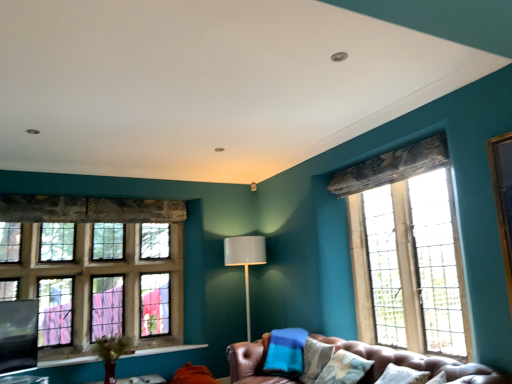
Question: From the image's perspective, is stained glass window at left, which is counted as the second window, starting from the right, located above matte gray lamp at center?

Choices:
 (A) no
 (B) yes

Answer: (B)

Question: Can we say stained glass window at left, the 1th window from the left, lies outside matte gray lamp at center?

Choices:
 (A) yes
 (B) no

Answer: (A)

Question: From a real-world perspective, is stained glass window at left, which is counted as the second window, starting from the right, under matte gray lamp at center?

Choices:
 (A) no
 (B) yes

Answer: (A)

Question: Considering the relative sizes of stained glass window at left, which is counted as the second window, starting from the right, and matte gray lamp at center in the image provided, is stained glass window at left, which is counted as the second window, starting from the right, shorter than matte gray lamp at center?

Choices:
 (A) yes
 (B) no

Answer: (A)

Question: Can you confirm if stained glass window at left, the 1th window from the back, is positioned to the left of matte gray lamp at center?

Choices:
 (A) no
 (B) yes

Answer: (B)

Question: From a real-world perspective, relative to black matte window screen at lower left, is stained glass window at left, the 1th window from the back, vertically above or below?

Choices:
 (A) above
 (B) below

Answer: (A)

Question: Which is correct: stained glass window at left, the 1th window from the left, is inside black matte window screen at lower left, or outside of it?

Choices:
 (A) outside
 (B) inside

Answer: (A)

Question: From the image's perspective, is stained glass window at left, the 1th window from the back, above or below black matte window screen at lower left?

Choices:
 (A) below
 (B) above

Answer: (B)

Question: Considering the positions of stained glass window at left, the 1th window from the back, and black matte window screen at lower left in the image, is stained glass window at left, the 1th window from the back, bigger or smaller than black matte window screen at lower left?

Choices:
 (A) big
 (B) small

Answer: (A)

Question: Is point [x=247, y=283] positioned closer to the camera than point [x=62, y=205]?

Choices:
 (A) closer
 (B) farther

Answer: (B)

Question: In terms of width, does matte gray lamp at center look wider or thinner when compared to stained glass window at left, marked as the second window in a front-to-back arrangement?

Choices:
 (A) thin
 (B) wide

Answer: (B)

Question: From the image's perspective, is matte gray lamp at center located above or below stained glass window at left, which is counted as the second window, starting from the right?

Choices:
 (A) below
 (B) above

Answer: (A)

Question: In the image, is matte gray lamp at center positioned in front of or behind stained glass window at left, the 1th window from the back?

Choices:
 (A) behind
 (B) front

Answer: (A)

Question: From a real-world perspective, is leather couch at lower center positioned above or below clear glass window at right, placed as the 1th window when sorted from front to back?

Choices:
 (A) below
 (B) above

Answer: (A)

Question: Is leather couch at lower center bigger or smaller than clear glass window at right, which is counted as the 2th window, starting from the back?

Choices:
 (A) small
 (B) big

Answer: (B)